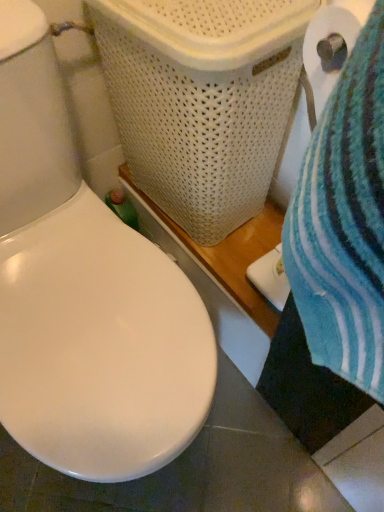
Question: Is white paper at right positioned beyond the bounds of white woven laundry basket at upper center?

Choices:
 (A) yes
 (B) no

Answer: (A)

Question: Is white paper at right at the left side of white woven laundry basket at upper center?

Choices:
 (A) yes
 (B) no

Answer: (B)

Question: From a real-world perspective, is white paper at right physically below white woven laundry basket at upper center?

Choices:
 (A) no
 (B) yes

Answer: (A)

Question: Does white paper at right have a lesser height compared to white woven laundry basket at upper center?

Choices:
 (A) yes
 (B) no

Answer: (A)

Question: Is white paper at right further to the viewer compared to white woven laundry basket at upper center?

Choices:
 (A) no
 (B) yes

Answer: (A)

Question: Does white paper at right have a greater height compared to white woven laundry basket at upper center?

Choices:
 (A) no
 (B) yes

Answer: (A)

Question: From the image's perspective, is white woven laundry basket at upper center located beneath white paper at right?

Choices:
 (A) yes
 (B) no

Answer: (B)

Question: Considering the relative sizes of white woven laundry basket at upper center and white paper at right in the image provided, is white woven laundry basket at upper center shorter than white paper at right?

Choices:
 (A) yes
 (B) no

Answer: (B)

Question: Does white woven laundry basket at upper center have a greater width compared to white paper at right?

Choices:
 (A) yes
 (B) no

Answer: (A)

Question: Is white woven laundry basket at upper center thinner than white paper at right?

Choices:
 (A) no
 (B) yes

Answer: (A)

Question: Can you confirm if white woven laundry basket at upper center is taller than white paper at right?

Choices:
 (A) no
 (B) yes

Answer: (B)

Question: Considering the relative positions of white woven laundry basket at upper center and white paper at right in the image provided, is white woven laundry basket at upper center to the right of white paper at right from the viewer's perspective?

Choices:
 (A) no
 (B) yes

Answer: (A)

Question: From the image's perspective, is white woven laundry basket at upper center above or below white paper at right?

Choices:
 (A) above
 (B) below

Answer: (A)